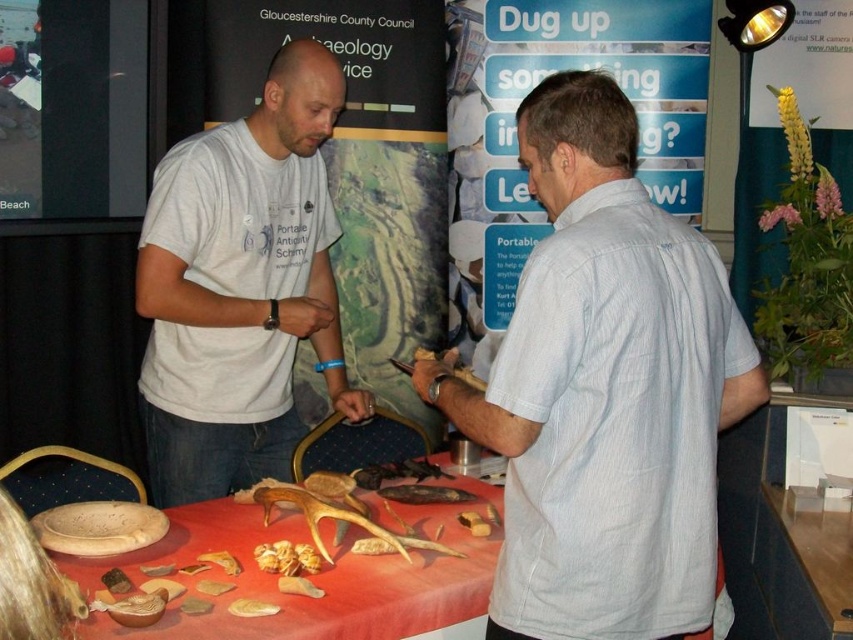
Question: Estimate the real-world distances between objects in this image. Which object is closer to the matte red tablecloth at center?

Choices:
 (A) brown wooden fish at center
 (B) white matte t-shirt at center
 (C) white striped shirt at right

Answer: (A)

Question: Does white matte t-shirt at center appear on the right side of matte red tablecloth at center?

Choices:
 (A) yes
 (B) no

Answer: (B)

Question: Does matte red tablecloth at center lie in front of brown wooden fish at center?

Choices:
 (A) no
 (B) yes

Answer: (B)

Question: Which point is closer to the camera taking this photo?

Choices:
 (A) (653, 323)
 (B) (154, 545)
 (C) (312, 568)

Answer: (A)

Question: Among these objects, which one is nearest to the camera?

Choices:
 (A) golden textured seeds at center
 (B) matte red tablecloth at center

Answer: (B)

Question: Is golden textured seeds at center bigger than brown wooden fish at center?

Choices:
 (A) no
 (B) yes

Answer: (A)